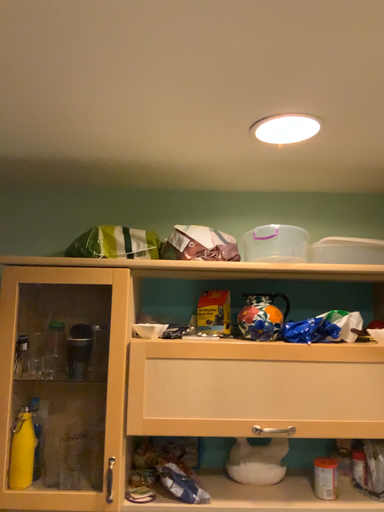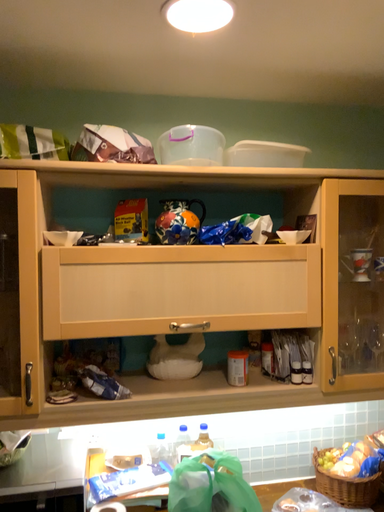
Question: Which way did the camera rotate in the video?

Choices:
 (A) rotated right
 (B) rotated left

Answer: (A)